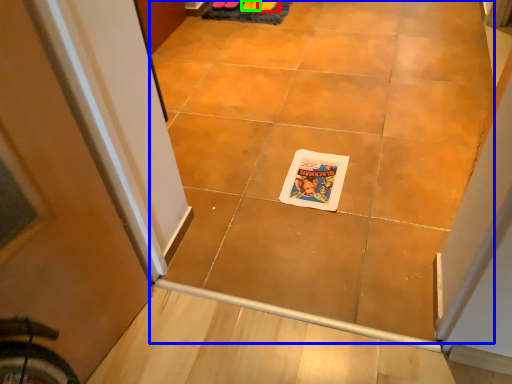
Question: Which is nearer to the footwear (highlighted by a red box)? ceramic tile (highlighted by a blue box) or footwear (highlighted by a green box).

Choices:
 (A) ceramic tile
 (B) footwear

Answer: (B)